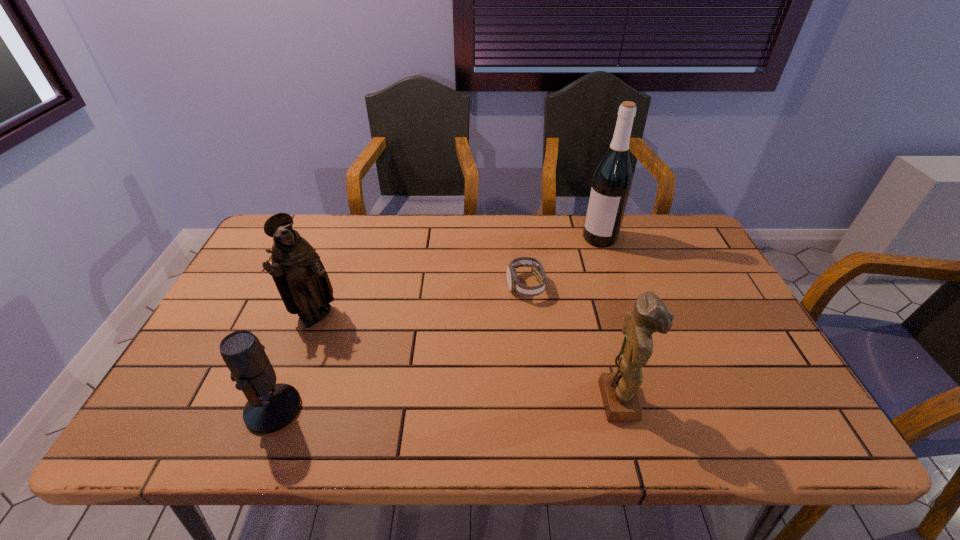
This screenshot has width=960, height=540. Identify the location of free spot on the desktop that is between the microphone and the right figurine and is positioned on the face of the fourth nearest object. (444, 405).

I want to click on free space on the desktop that is between the microphone and the nearer figurine and is positioned on the front-facing side of the third farthest object, so click(490, 404).

Where is `vacant space on the desktop that is between the fourth tallest object and the nearer figurine and is positioned on the label of the tallest object`? The image size is (960, 540). vacant space on the desktop that is between the fourth tallest object and the nearer figurine and is positioned on the label of the tallest object is located at coordinates (451, 404).